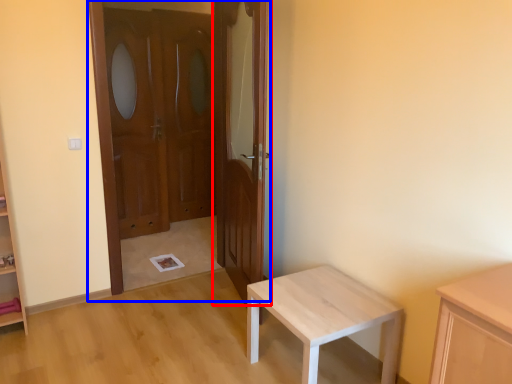
Question: Which of the following is the closest to the observer, door (highlighted by a red box) or door (highlighted by a blue box)?

Choices:
 (A) door
 (B) door

Answer: (A)